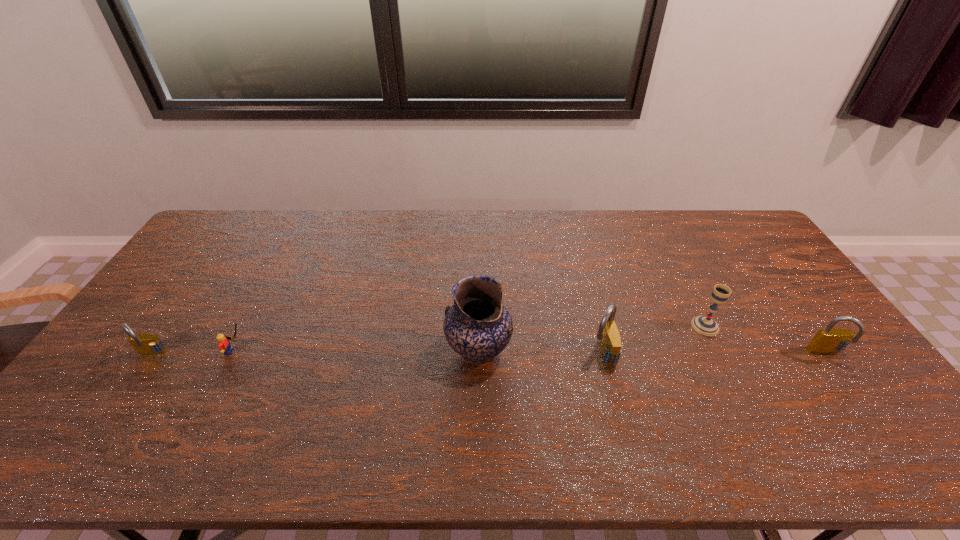
Please point a spot to place another padlock for symmetrical spacing. Please provide its 2D coordinates. Your answer should be formatted as a tuple, i.e. [(x, y)], where the tuple contains the x and y coordinates of a point satisfying the conditions above.

[(377, 355)]